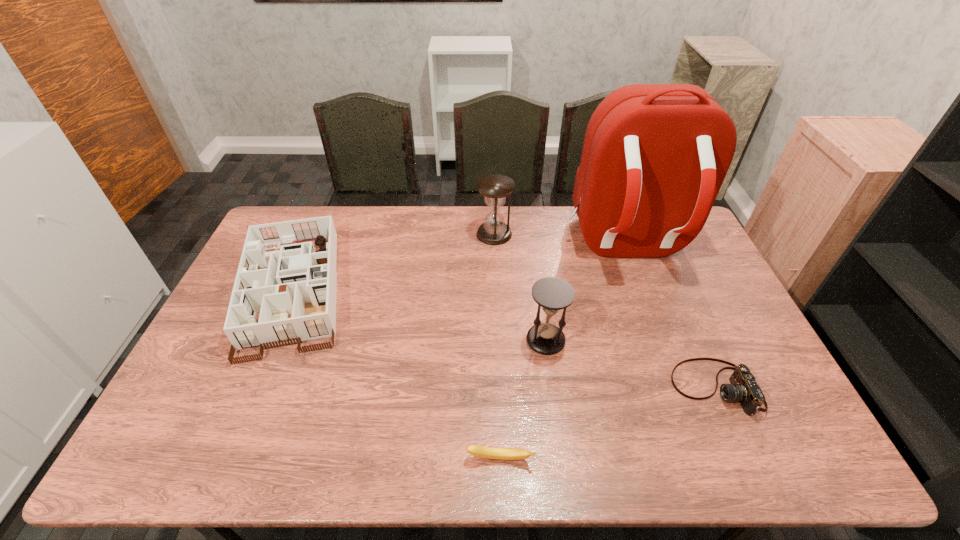
Locate an element on the screen. free region that satisfies the following two spatial constraints: 1. on the back side of the dollhouse; 2. on the left side of the farther hourglass is located at coordinates (317, 234).

What are the coordinates of `free space that satisfies the following two spatial constraints: 1. on the front-facing side of the camera; 2. at the stem of the banana` in the screenshot? It's located at (746, 458).